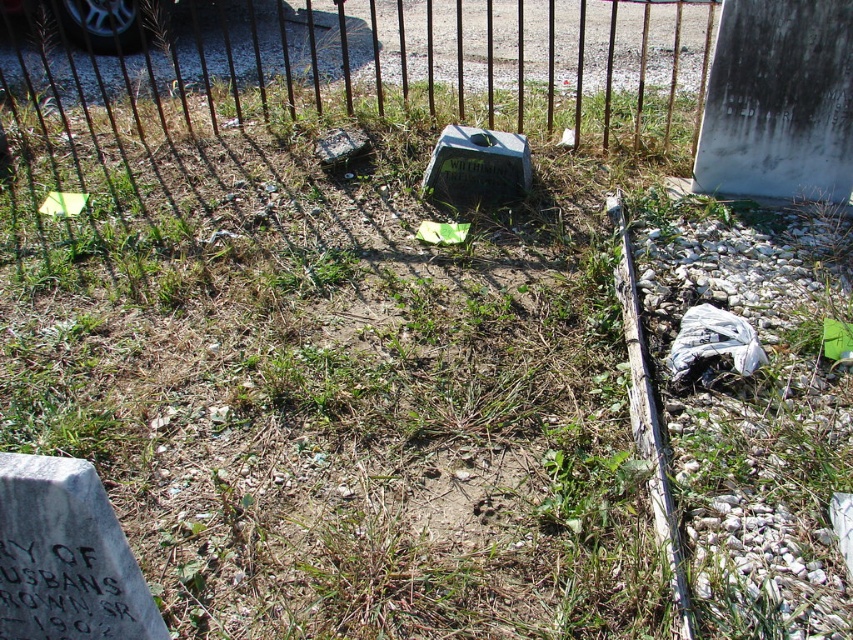
In the scene shown: You are a maintenance worker assessing the cemetery layout. You need to determine the spatial relationship between the rusty metal fence at upper center and the rusty metal gravestone at center. Which object is positioned higher up in the image?

The rusty metal fence at upper center is positioned higher up in the image than the rusty metal gravestone at center.

Looking at this image, you are a groundskeeper inspecting the cemetery. You notice the rusty metal fence at upper center and the green plastic gravestone at center. Which object is closer to the top edge of the image?

The rusty metal fence at upper center is closer to the top edge of the image because it is positioned over the green plastic gravestone at center, meaning it is above it.